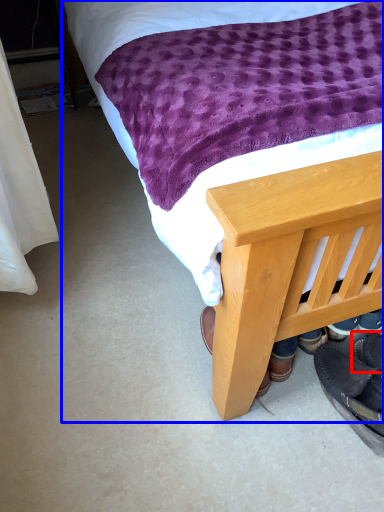
Question: Among these objects, which one is farthest to the camera, footwear (highlighted by a red box) or bed (highlighted by a blue box)?

Choices:
 (A) footwear
 (B) bed

Answer: (A)